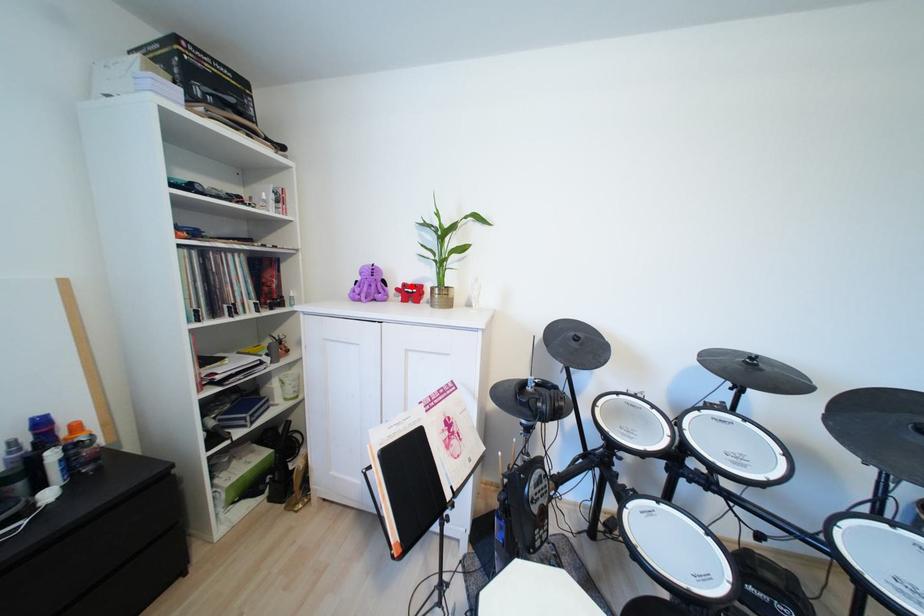
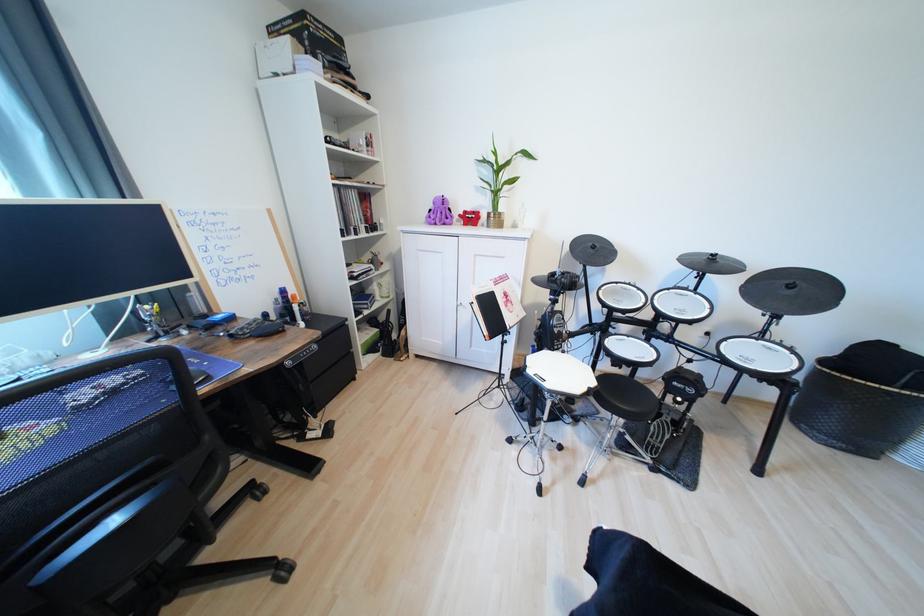
The point at the highlighted location is marked in the first image. Where is the corresponding point in the second image?

(472, 214)